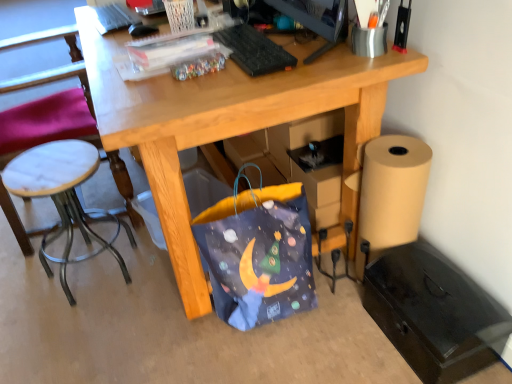
Find the location of a particular element. This screenshot has width=512, height=384. vacant space that is in between white marble stool at left and white marble stool at left is located at coordinates coord(54,278).